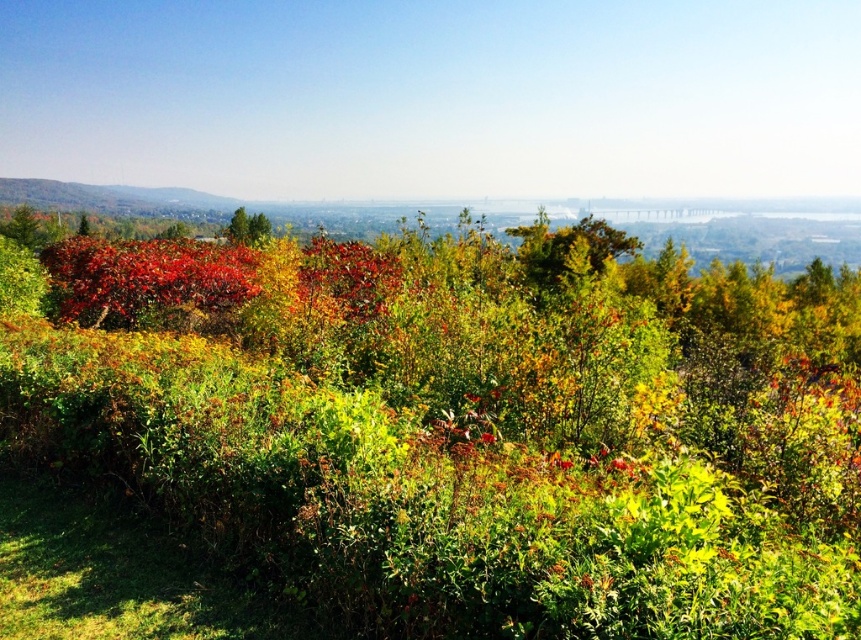
Question: Does shiny red leaves at center lie in front of green leafy tree at center?

Choices:
 (A) no
 (B) yes

Answer: (B)

Question: Is the position of green leafy bush at center more distant than that of green leafy tree at center?

Choices:
 (A) yes
 (B) no

Answer: (B)

Question: Which object appears farthest from the camera in this image?

Choices:
 (A) green leafy tree at center
 (B) green leafy bush at center
 (C) green matte tree at center

Answer: (C)

Question: Can you confirm if green leafy tree at center is positioned above green matte tree at center?

Choices:
 (A) yes
 (B) no

Answer: (B)

Question: Among these points, which one is farthest from the camera?

Choices:
 (A) (197, 285)
 (B) (599, 257)
 (C) (524, 468)

Answer: (B)

Question: Estimate the real-world distances between objects in this image. Which object is farther from the green leafy bush at center?

Choices:
 (A) shiny red leaves at center
 (B) green matte tree at center
 (C) green leafy tree at center

Answer: (B)